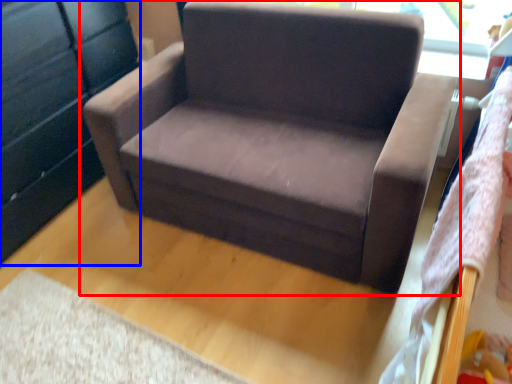
Question: Which object is further to the camera taking this photo, chair (highlighted by a red box) or dresser (highlighted by a blue box)?

Choices:
 (A) chair
 (B) dresser

Answer: (B)